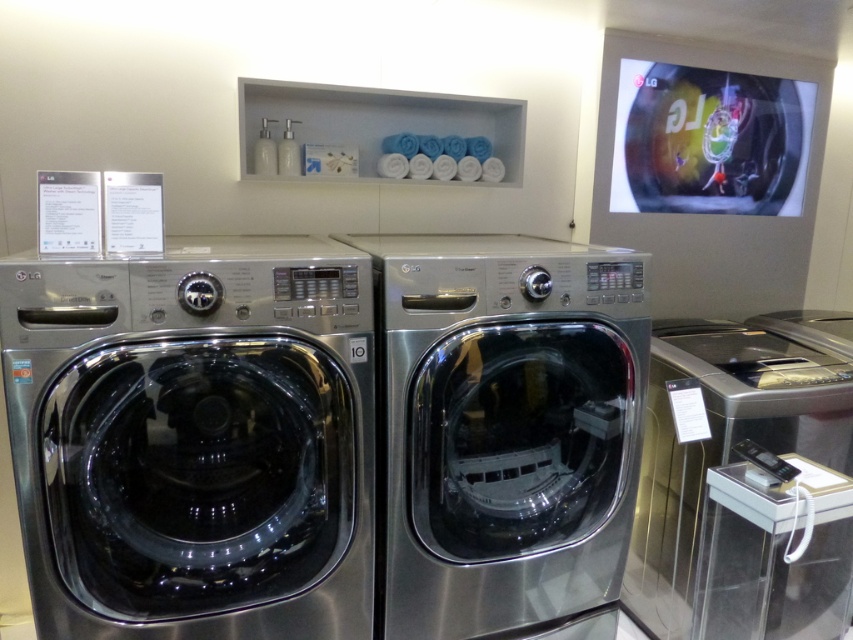
You are a delivery person who needs to place a new washing machine between the stainless steel washing machine at left and the stainless steel washing machine at right. The new machine is 0.5 meters wide. Is there enough space between them to fit the new machine?

The stainless steel washing machine at left and the stainless steel washing machine at right are 1.21 meters apart, so yes, the new machine which is 0.5 meters wide can fit between them since the space is wider than the machine.

You are a customer in a store looking at two appliances. You need to place a large box in front of the stainless steel washing machine at left and the stainless steel dryer at center. Which appliance should you place the box to the right of to ensure it aligns with the existing shelf layout?

You should place the box to the right of the stainless steel dryer at center because the stainless steel washing machine at left is already positioned to the left of the stainless steel dryer at center, so placing the box to the right of the dryer maintains alignment with the existing shelf layout.

From the picture: You are a customer in the store and want to compare the control panels of the stainless steel washing machine at left and the stainless steel dryer at right. Which one has its control panel positioned higher?

The stainless steel washing machine at left has its control panel positioned higher than the stainless steel dryer at right because the stainless steel washing machine at left is above the stainless steel dryer at right.